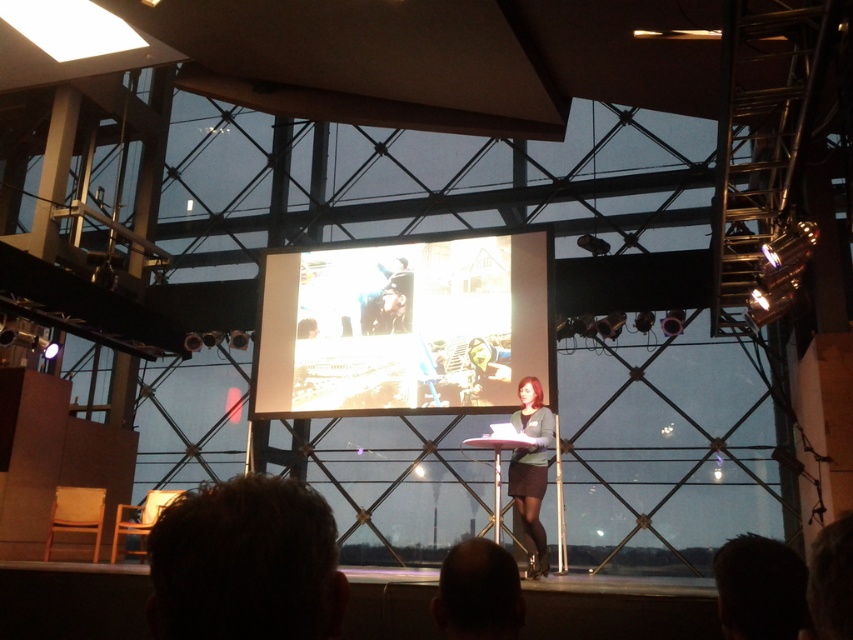
The image size is (853, 640). What do you see at coordinates (479, 593) in the screenshot?
I see `dark brown hair at lower center` at bounding box center [479, 593].

Can you confirm if dark brown hair at lower center is smaller than matte gray sweater at center?

Yes.

The image size is (853, 640). What are the coordinates of `dark brown hair at lower center` in the screenshot? It's located at point(479,593).

How much distance is there between white glossy screen at center and matte gray sweater at center?

white glossy screen at center and matte gray sweater at center are 4.54 feet apart from each other.

Is white glossy screen at center to the right of matte gray sweater at center from the viewer's perspective?

No, white glossy screen at center is not to the right of matte gray sweater at center.

Who is more forward, (508, 241) or (514, 413)?

Positioned in front is point (514, 413).

Locate an element on the screen. The width and height of the screenshot is (853, 640). white glossy screen at center is located at coordinates (402, 326).

Is dark brown hair at lower left bigger than dark brown hair at lower center?

Yes.

Based on the photo, can you confirm if dark brown hair at lower left is positioned to the left of dark brown hair at lower center?

Yes, dark brown hair at lower left is to the left of dark brown hair at lower center.

Locate an element on the screen. dark brown hair at lower left is located at coordinates (247, 563).